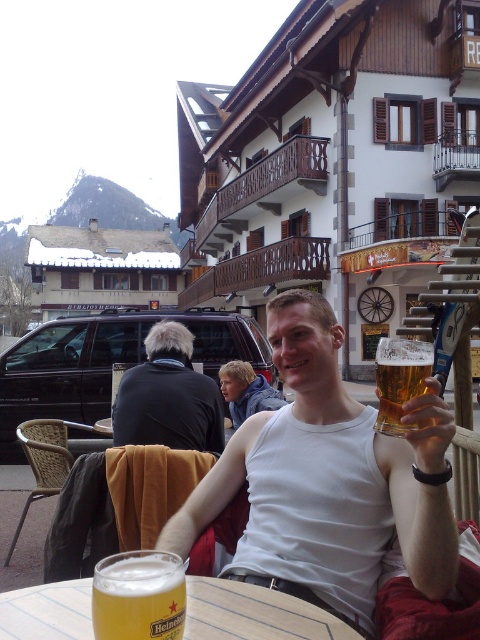
Who is positioned more to the left, white tank top at center or snow-covered wooden building at upper left?

snow-covered wooden building at upper left is more to the left.

Based on the photo, between white tank top at center and snow-covered wooden building at upper left, which one is positioned higher?

snow-covered wooden building at upper left is higher up.

You are a GUI agent. You are given a task and a screenshot of the screen. Output one action in this format:
    pyautogui.click(x=<x>, y=<y>)
    Task: Click on the white tank top at center
    
    Given the screenshot: What is the action you would take?
    pyautogui.click(x=328, y=481)

Is wooden balcony at upper center to the left of white tank top at center from the viewer's perspective?

Indeed, wooden balcony at upper center is positioned on the left side of white tank top at center.

Is wooden balcony at upper center bigger than white tank top at center?

Yes, wooden balcony at upper center is bigger than white tank top at center.

This screenshot has height=640, width=480. Find the location of `wooden balcony at upper center`. wooden balcony at upper center is located at coordinates (335, 157).

Between point (238, 596) and point (186, 346), which one is positioned in front?

Positioned in front is point (238, 596).

Who is taller, clear plastic glass at center or dark gray sweater at left?

Standing taller between the two is dark gray sweater at left.

Which is in front, point (69, 605) or point (120, 429)?

Positioned in front is point (69, 605).

At what (x,y) coordinates should I click in order to perform the action: click on clear plastic glass at center. Please return your answer as a coordinate pair (x, y). Looking at the image, I should click on (254, 612).